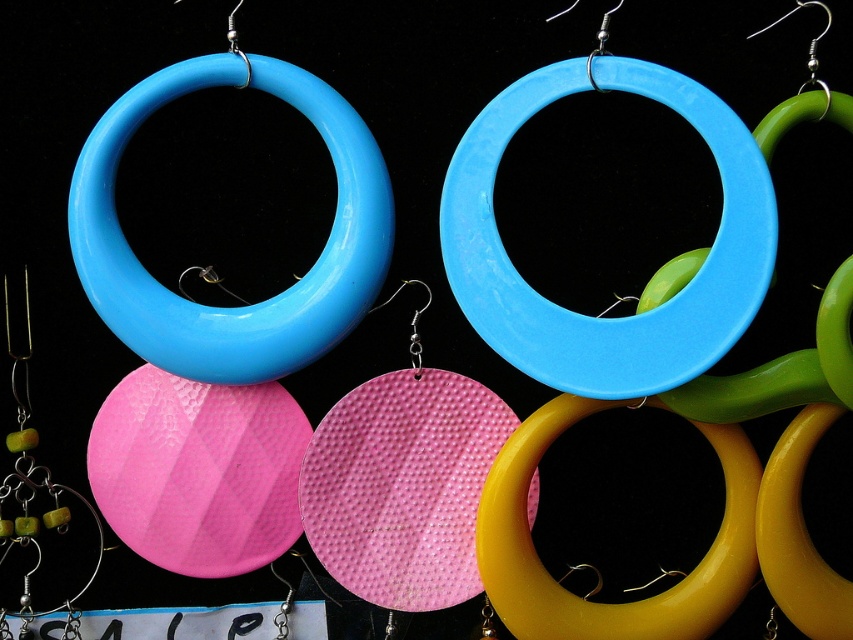
Question: Which is nearer to the matte plastic hoop at upper left?

Choices:
 (A) glossy plastic hoop at center
 (B) yellow glossy hoop at center

Answer: (A)

Question: Based on their relative distances, which object is farther from the yellow glossy hoop at center?

Choices:
 (A) glossy plastic hoop at center
 (B) matte plastic hoop at upper left

Answer: (B)

Question: Observing the image, what is the correct spatial positioning of glossy plastic hoop at center in reference to matte plastic hoop at upper left?

Choices:
 (A) left
 (B) right

Answer: (B)

Question: Is glossy plastic hoop at center above matte plastic hoop at upper left?

Choices:
 (A) no
 (B) yes

Answer: (A)

Question: Is glossy plastic hoop at center below matte plastic hoop at upper left?

Choices:
 (A) no
 (B) yes

Answer: (B)

Question: Which object is farther from the camera taking this photo?

Choices:
 (A) yellow glossy hoop at center
 (B) matte plastic hoop at upper left
 (C) glossy plastic hoop at center

Answer: (A)